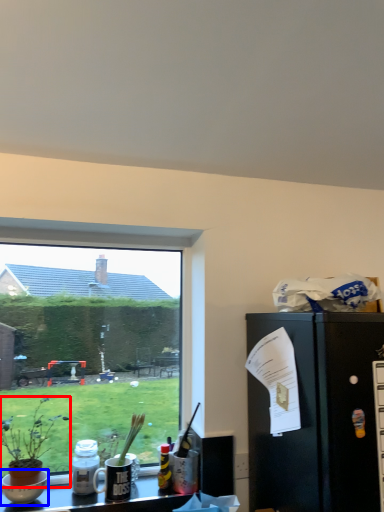
Question: Which of the following is the closest to the observer, houseplant (highlighted by a red box) or bowl (highlighted by a blue box)?

Choices:
 (A) houseplant
 (B) bowl

Answer: (A)